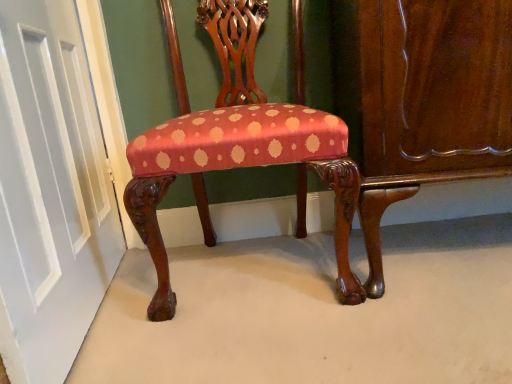
You are a GUI agent. You are given a task and a screenshot of the screen. Output one action in this format:
    pyautogui.click(x=<x>, y=<y>)
    Task: Click on the free point below silky red fabric chair at center (from a real-world perspective)
    
    Given the screenshot: What is the action you would take?
    pyautogui.click(x=250, y=269)